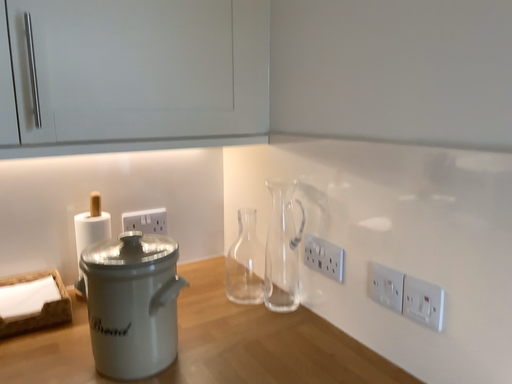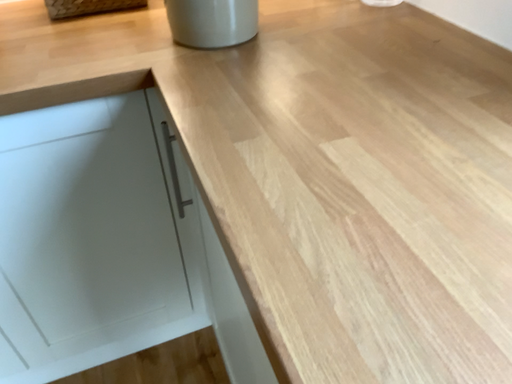
Question: Which way did the camera rotate in the video?

Choices:
 (A) rotated right
 (B) rotated left

Answer: (B)